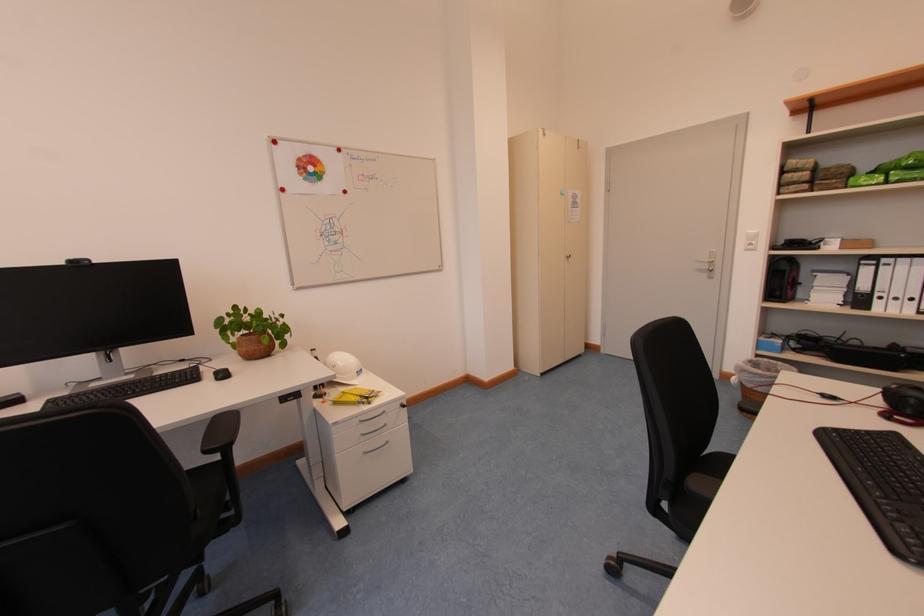
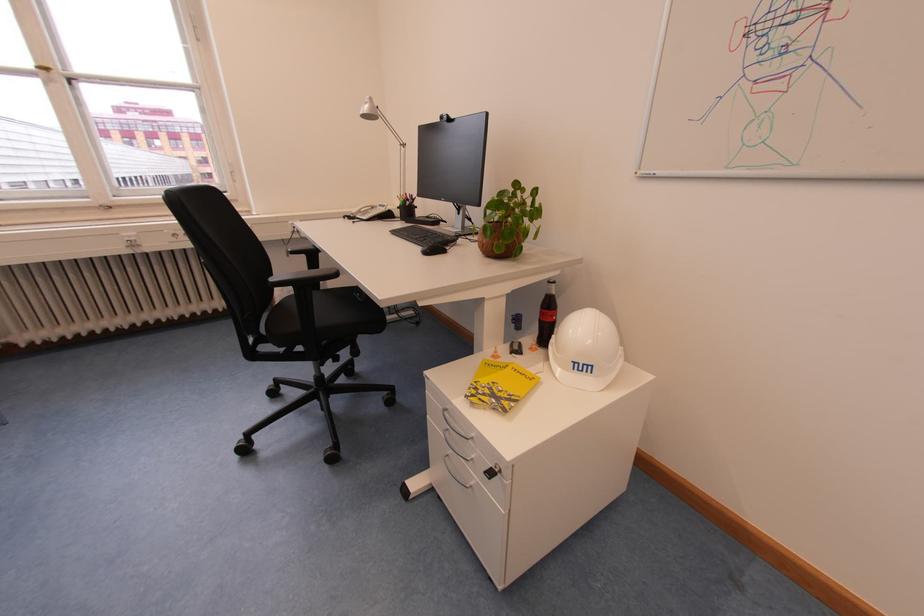
In the second image, find the point that corresponds to point 242,310 in the first image.

(524, 187)